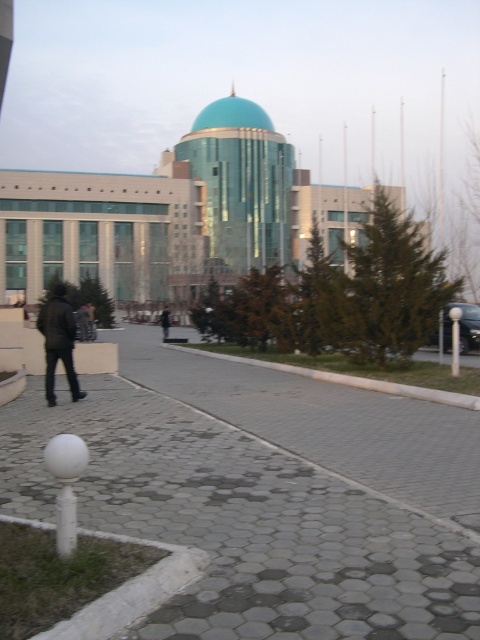
You are standing in front of the modern architectural structure with the turquoise dome. You see a dark brown leather jacket at left and a black leather jacket at center. Which jacket is taller?

The dark brown leather jacket at left is much taller than the black leather jacket at center.

You are standing in front of the modern architectural structure with the turquoise dome. You see a dark brown leather jacket at left and a black leather jacket at center. Which jacket is nearer to you?

The dark brown leather jacket at left is closer to the viewer than the black leather jacket at center, so the dark brown one is nearer.